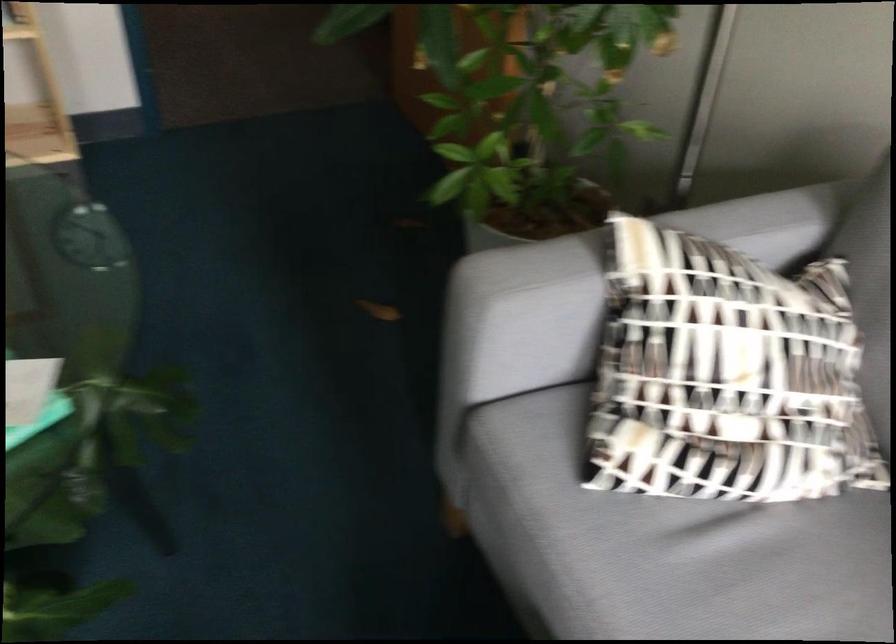
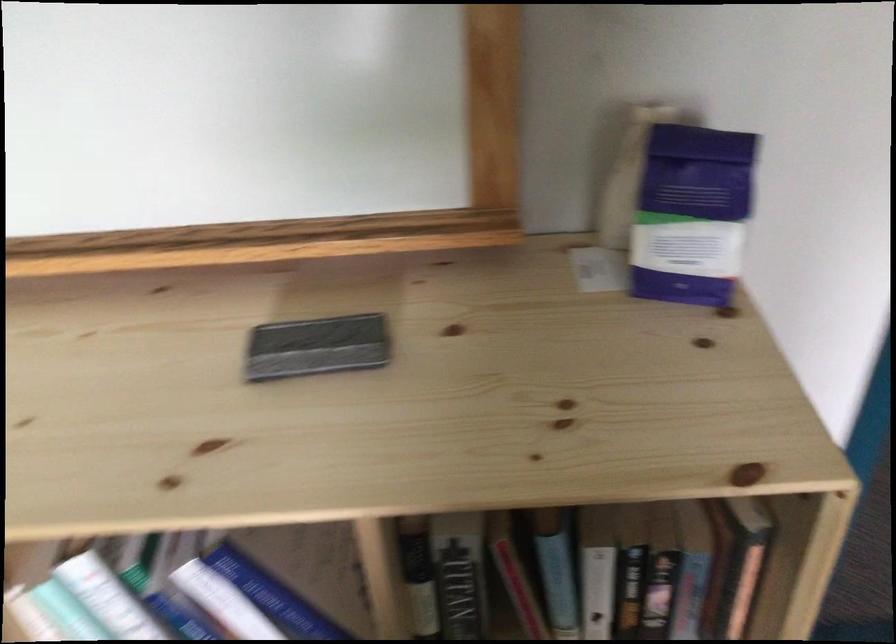
The images are taken continuously from a first-person perspective. In which direction are you moving?

The movement direction of the cameraman is left, forward.